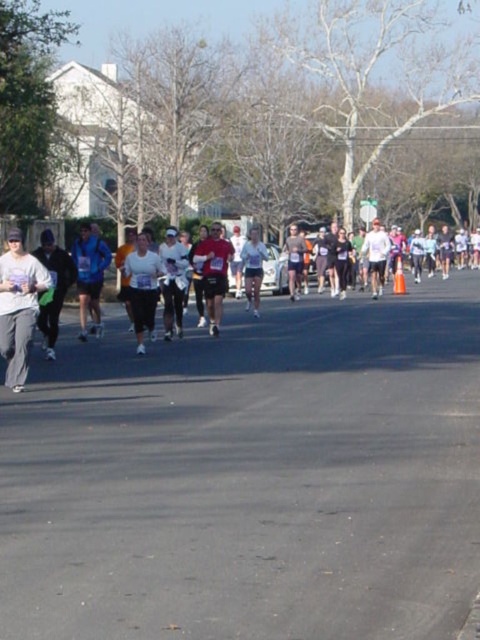
This screenshot has width=480, height=640. I want to click on white matte shirt at center, so click(x=143, y=288).

Where is `white matte shirt at center`? Image resolution: width=480 pixels, height=640 pixels. white matte shirt at center is located at coordinates (143, 288).

What are the coordinates of `gray matte pants at left` in the screenshot? It's located at (19, 307).

Which is more to the right, gray matte pants at left or white matte shirt at center?

white matte shirt at center is more to the right.

What do you see at coordinates (19, 307) in the screenshot? I see `gray matte pants at left` at bounding box center [19, 307].

Where is `gray matte pants at left`? The width and height of the screenshot is (480, 640). gray matte pants at left is located at coordinates (19, 307).

Can you confirm if gray matte pants at left is taller than matte red shirt at center?

Incorrect, gray matte pants at left's height is not larger of matte red shirt at center's.

Is point (14, 291) positioned in front of point (217, 269)?

Yes, it is.

Between point (33, 317) and point (216, 298), which one is positioned behind?

Positioned behind is point (216, 298).

Locate an element on the screen. The image size is (480, 640). gray matte pants at left is located at coordinates (19, 307).